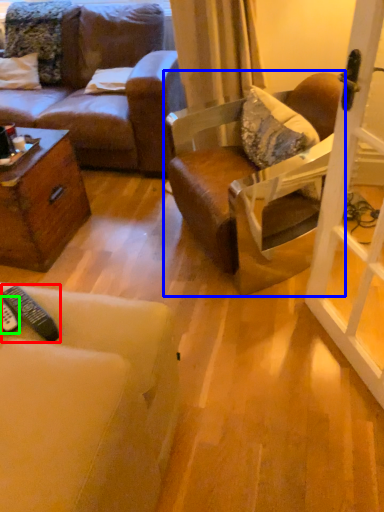
Question: Considering the real-world distances, which object is closest to remote control (highlighted by a red box)? chair (highlighted by a blue box) or remote control (highlighted by a green box).

Choices:
 (A) chair
 (B) remote control

Answer: (B)